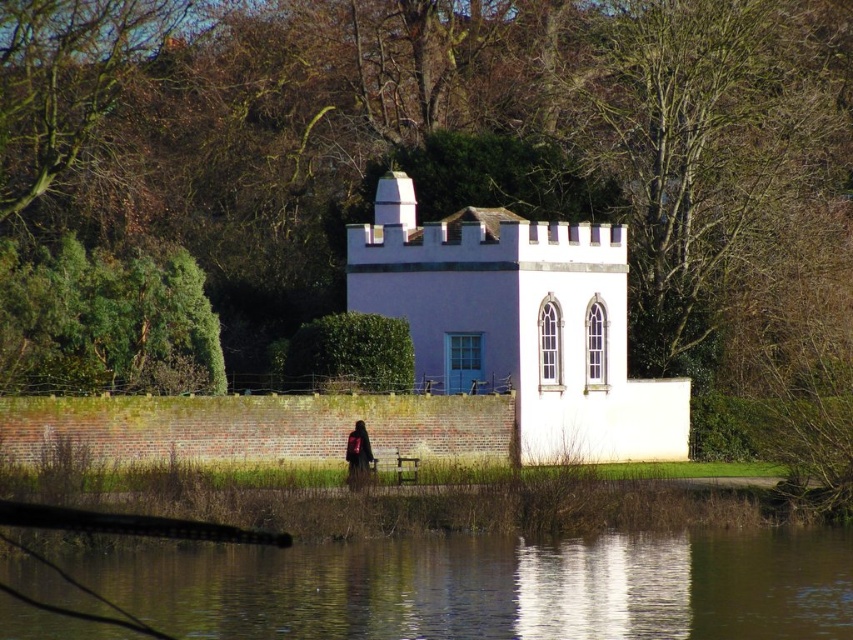
Looking at this image, can you confirm if transparent water at lower center is taller than white smooth chapel at center?

No, transparent water at lower center is not taller than white smooth chapel at center.

Is point (769, 632) positioned in front of point (492, 333)?

Yes, it is.

The width and height of the screenshot is (853, 640). Identify the location of transparent water at lower center. (494, 588).

This screenshot has width=853, height=640. Identify the location of transparent water at lower center. (494, 588).

From the picture: Is white smooth chapel at center closer to camera compared to dark brown leather backpack at center?

No, it is not.

Can you confirm if white smooth chapel at center is positioned to the right of dark brown leather backpack at center?

Correct, you'll find white smooth chapel at center to the right of dark brown leather backpack at center.

What do you see at coordinates (518, 323) in the screenshot? The height and width of the screenshot is (640, 853). I see `white smooth chapel at center` at bounding box center [518, 323].

Where is `white smooth chapel at center`? This screenshot has height=640, width=853. white smooth chapel at center is located at coordinates (518, 323).

Does transparent water at lower center appear under dark brown leather backpack at center?

Yes, transparent water at lower center is below dark brown leather backpack at center.

Is point (13, 620) farther from camera compared to point (358, 476)?

No.

Locate an element on the screen. Image resolution: width=853 pixels, height=640 pixels. transparent water at lower center is located at coordinates (494, 588).